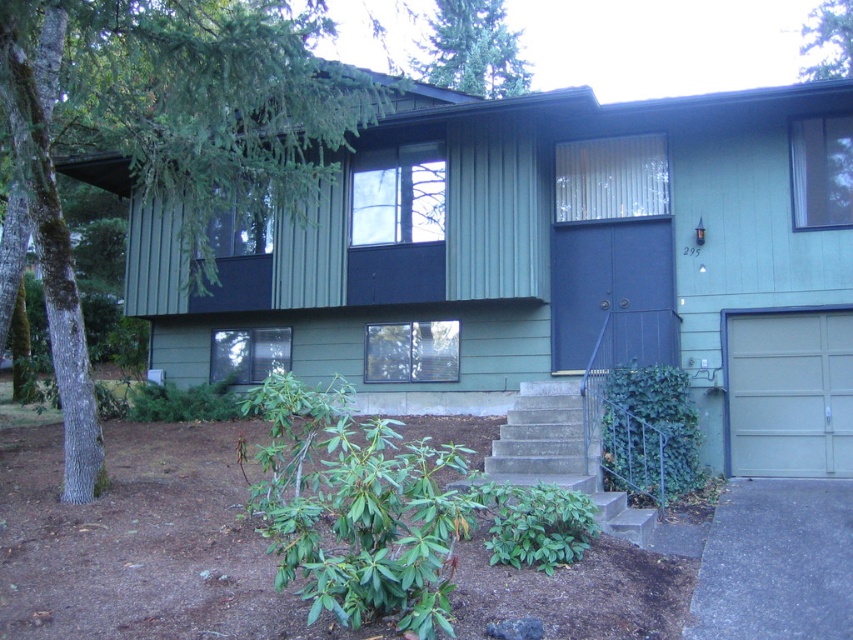
Does green mossy tree at left appear on the left side of matte gray garage door at lower right?

Correct, you'll find green mossy tree at left to the left of matte gray garage door at lower right.

Does green mossy tree at left have a larger size compared to matte gray garage door at lower right?

No.

Which is behind, point (345, 131) or point (735, 451)?

Positioned behind is point (735, 451).

At what (x,y) coordinates should I click in order to perform the action: click on green mossy tree at left. Please return your answer as a coordinate pair (x, y). Looking at the image, I should click on (164, 136).

Who is lower down, green matte garage door at center or matte gray garage door at lower right?

matte gray garage door at lower right is lower down.

How far apart are green matte garage door at center and matte gray garage door at lower right?

green matte garage door at center is 6.61 feet away from matte gray garage door at lower right.

Is point (601, 276) positioned after point (840, 419)?

Yes, it is behind point (840, 419).

The image size is (853, 640). I want to click on green matte garage door at center, so click(543, 256).

What do you see at coordinates (543, 256) in the screenshot? I see `green matte garage door at center` at bounding box center [543, 256].

Which is below, green matte garage door at center or gray concrete driveway at lower right?

Positioned lower is gray concrete driveway at lower right.

What do you see at coordinates (543, 256) in the screenshot? The width and height of the screenshot is (853, 640). I see `green matte garage door at center` at bounding box center [543, 256].

Locate an element on the screen. This screenshot has width=853, height=640. green matte garage door at center is located at coordinates pos(543,256).